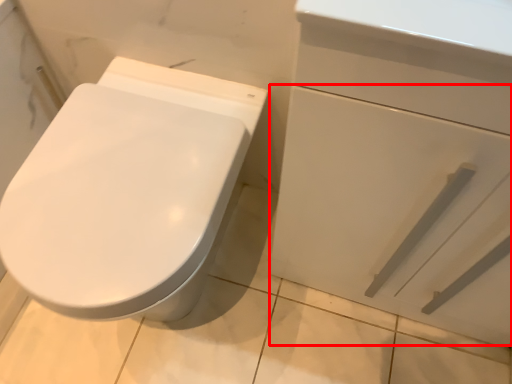
Question: From the image's perspective, what is the correct spatial positioning of drawer (annotated by the red box) in reference to bidet?

Choices:
 (A) above
 (B) below

Answer: (A)